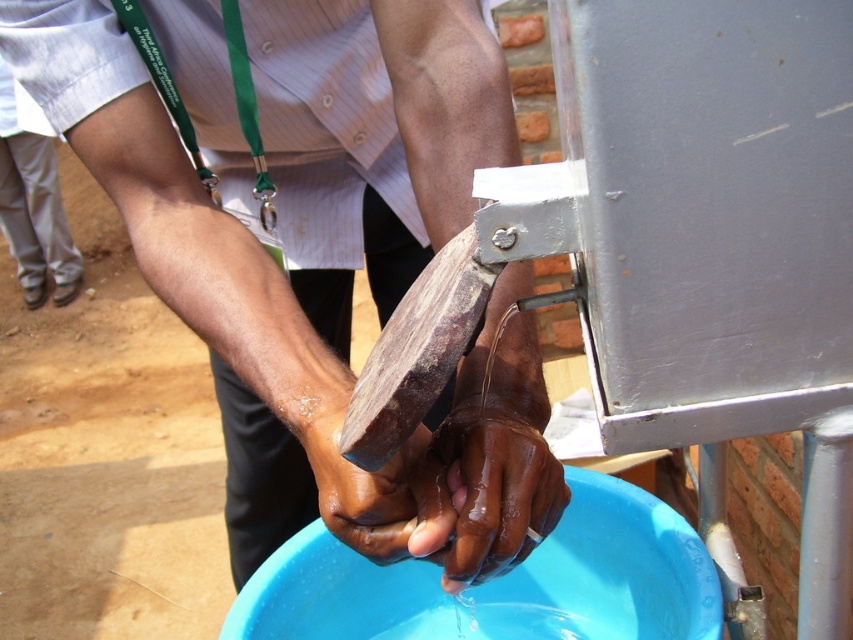
Question: Is brown wooden block at center wider than brown matte wooden block at center?

Choices:
 (A) yes
 (B) no

Answer: (A)

Question: Does brown wooden block at center appear on the left side of brown matte hand at lower center?

Choices:
 (A) no
 (B) yes

Answer: (B)

Question: Which object appears farthest from the camera in this image?

Choices:
 (A) brown matte wooden block at center
 (B) brown wooden block at center

Answer: (A)

Question: Which point is closer to the camera?

Choices:
 (A) (367, 515)
 (B) (28, 12)
 (C) (432, 513)

Answer: (C)

Question: Considering the relative positions of brown wooden block at center and brown matte wooden block at center in the image provided, where is brown wooden block at center located with respect to brown matte wooden block at center?

Choices:
 (A) right
 (B) left

Answer: (B)

Question: Which object is closer to the camera taking this photo?

Choices:
 (A) brown matte wooden block at center
 (B) brown wooden block at center
 (C) brown matte hand at lower center

Answer: (C)